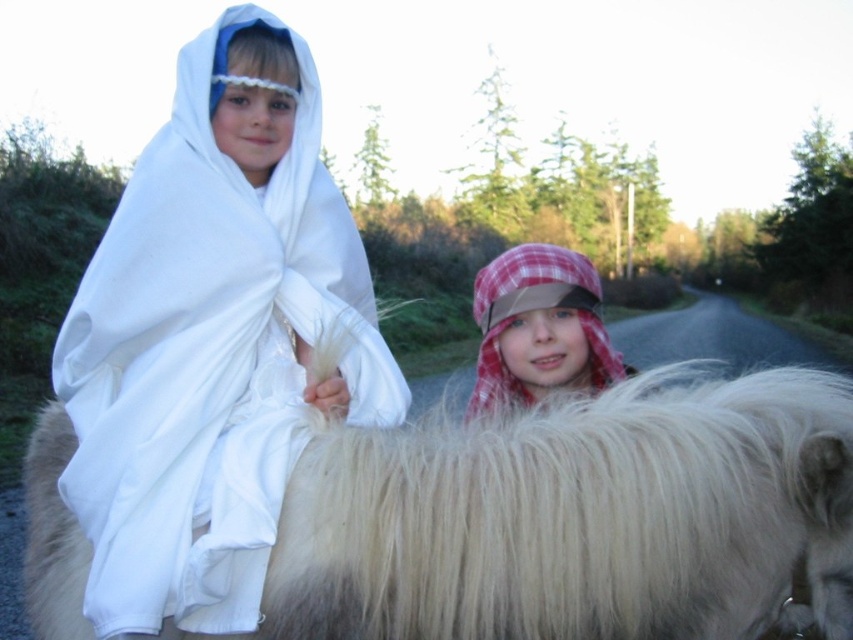
Question: Can you confirm if white cloth at upper left is positioned to the right of plaid fabric hat at center?

Choices:
 (A) yes
 (B) no

Answer: (B)

Question: Which point appears closest to the camera in this image?

Choices:
 (A) (780, 440)
 (B) (491, 284)

Answer: (A)

Question: Is white cloth at upper left wider than plaid fabric hat at center?

Choices:
 (A) yes
 (B) no

Answer: (A)

Question: Based on their relative distances, which object is nearer to the fluffy white horse at center?

Choices:
 (A) plaid fabric hat at center
 (B) white cloth at upper left

Answer: (B)

Question: Which of these objects is positioned closest to the fluffy white horse at center?

Choices:
 (A) white cloth at upper left
 (B) plaid fabric hat at center

Answer: (A)

Question: Is fluffy white horse at center above white cloth at upper left?

Choices:
 (A) no
 (B) yes

Answer: (A)